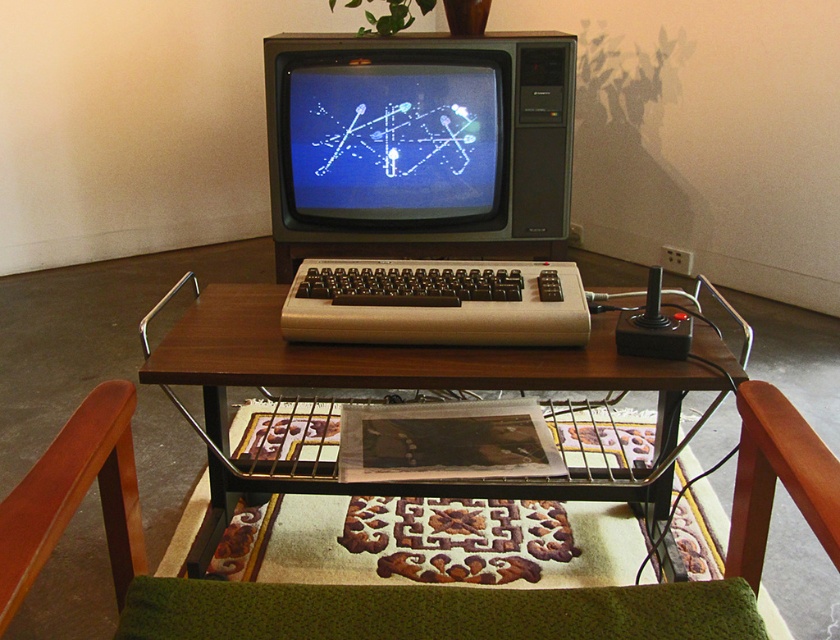
Question: Does matte black computer at center have a greater width compared to wooden table at center?

Choices:
 (A) no
 (B) yes

Answer: (A)

Question: Which object is closer to the camera taking this photo?

Choices:
 (A) wooden table at center
 (B) matte black computer at center

Answer: (A)

Question: Can you confirm if matte black computer at center is positioned to the left of wooden table at center?

Choices:
 (A) yes
 (B) no

Answer: (A)

Question: Which of the following is the closest to the observer?

Choices:
 (A) (421, 308)
 (B) (631, 364)

Answer: (B)

Question: Can you confirm if matte black computer at center is bigger than wooden table at center?

Choices:
 (A) no
 (B) yes

Answer: (A)

Question: Which object is closer to the camera taking this photo?

Choices:
 (A) wooden table at center
 (B) matte black computer at center

Answer: (A)